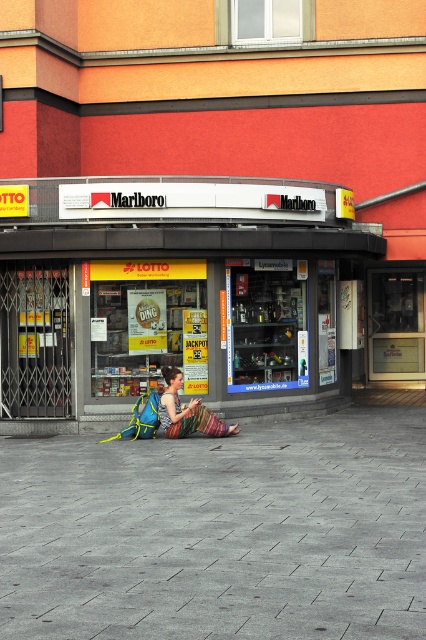
You are a delivery person standing outside the convenience store. You need to place a heavy box on the gray concrete pavement at lower center and the multicolored woven skirt at center. Which object should you choose to place the box on to avoid damaging the item?

You should place the heavy box on the gray concrete pavement at lower center because it is positioned on the right side of the multicolored woven skirt at center, making it more suitable for heavy items as the skirt might be delicate.

You are a delivery person with a 2.0 meter long box. You need to place the box on the gray concrete pavement at lower center and the multicolored woven skirt at center. Can the box fit between them without overlapping?

The gray concrete pavement at lower center is 2.13 meters away from the multicolored woven skirt at center. Since the box is 2.0 meters long, it can fit between them without overlapping.

You are standing in front of the convenience store and want to know the distance to the point marked as point (118, 333). Can you estimate how far it is from your current position?

The point (118, 333) is 53.94 feet away from the camera, so the distance from your current position to the point (118, 333) is approximately 53.94 feet.